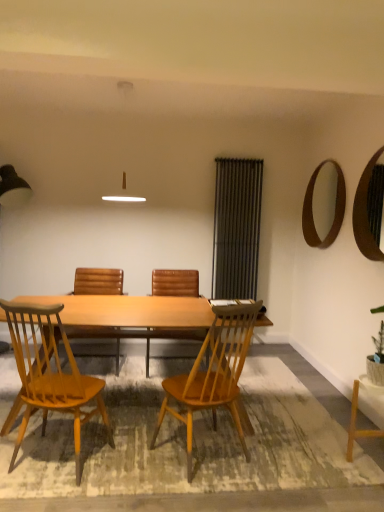
Question: From a real-world perspective, is brown leather chair at center, which is the second chair from back to front, located higher than light brown wood chair at center, arranged as the second chair when viewed from the front?

Choices:
 (A) yes
 (B) no

Answer: (B)

Question: Is brown leather chair at center, the 3th chair from the front, facing towards light brown wood chair at center, arranged as the second chair when viewed from the front?

Choices:
 (A) yes
 (B) no

Answer: (A)

Question: Would you say brown leather chair at center, the 3th chair from the front, is outside light brown wood chair at center, which is counted as the third chair, starting from the back?

Choices:
 (A) yes
 (B) no

Answer: (A)

Question: Is brown leather chair at center, the 3th chair from the front, next to light brown wood chair at center, arranged as the second chair when viewed from the front, and touching it?

Choices:
 (A) yes
 (B) no

Answer: (B)

Question: Does brown leather chair at center, the 3th chair from the front, appear on the right side of light brown wood chair at center, arranged as the second chair when viewed from the front?

Choices:
 (A) yes
 (B) no

Answer: (B)

Question: Is brown leather chair at center, the 3th chair from the front, facing away from light brown wood chair at center, arranged as the second chair when viewed from the front?

Choices:
 (A) yes
 (B) no

Answer: (B)

Question: Is the position of brown leather chair at center, the 3th chair from the front, more distant than that of green leafy plant at lower right?

Choices:
 (A) yes
 (B) no

Answer: (A)

Question: Does brown leather chair at center, the 3th chair from the front, have a lesser height compared to green leafy plant at lower right?

Choices:
 (A) no
 (B) yes

Answer: (A)

Question: Is brown leather chair at center, which is the second chair from back to front, not inside green leafy plant at lower right?

Choices:
 (A) yes
 (B) no

Answer: (A)

Question: Can you confirm if brown leather chair at center, the 3th chair from the front, is wider than green leafy plant at lower right?

Choices:
 (A) yes
 (B) no

Answer: (A)

Question: Would you say brown leather chair at center, the 3th chair from the front, contains green leafy plant at lower right?

Choices:
 (A) yes
 (B) no

Answer: (B)

Question: Is brown leather chair at center, which is the second chair from back to front, facing towards green leafy plant at lower right?

Choices:
 (A) yes
 (B) no

Answer: (B)

Question: Does metallic silver screen door at right have a lesser width compared to light wood desk at center?

Choices:
 (A) no
 (B) yes

Answer: (B)